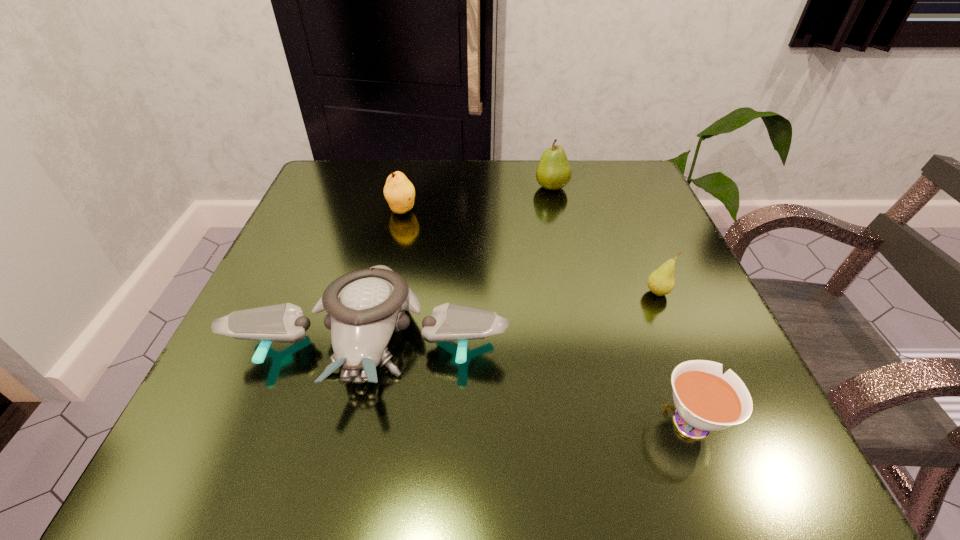
In the image, there is a desktop. Identify the location of vacant space at the left edge. This screenshot has width=960, height=540. (274, 401).

Find the location of a particular element. vacant region at the right edge of the desktop is located at coordinates (686, 338).

The width and height of the screenshot is (960, 540). Find the location of `vacant space at the far left corner of the desktop`. vacant space at the far left corner of the desktop is located at coordinates (325, 190).

The height and width of the screenshot is (540, 960). Identify the location of vacant space at the near left corner. (274, 430).

Locate an element on the screen. vacant space at the far right corner of the desktop is located at coordinates (624, 163).

You are a GUI agent. You are given a task and a screenshot of the screen. Output one action in this format:
    pyautogui.click(x=<x>, y=<y>)
    Task: Click on the vacant space that is in between the leftmost pear and the teacup
    The width and height of the screenshot is (960, 540).
    Given the screenshot: What is the action you would take?
    pyautogui.click(x=545, y=314)

At what (x,y) coordinates should I click in order to perform the action: click on unoccupied area between the drone and the nearest pear. Please return your answer as a coordinate pair (x, y). Looking at the image, I should click on (515, 315).

Identify the location of empty space between the rightmost pear and the farthest pear. (605, 240).

You are a GUI agent. You are given a task and a screenshot of the screen. Output one action in this format:
    pyautogui.click(x=<x>, y=<y>)
    Task: Click on the blank region between the drone and the teacup
    This screenshot has height=540, width=960.
    Given the screenshot: What is the action you would take?
    pyautogui.click(x=530, y=377)

Locate an element on the screen. This screenshot has width=960, height=540. free area in between the third object from right to left and the leftmost pear is located at coordinates (477, 199).